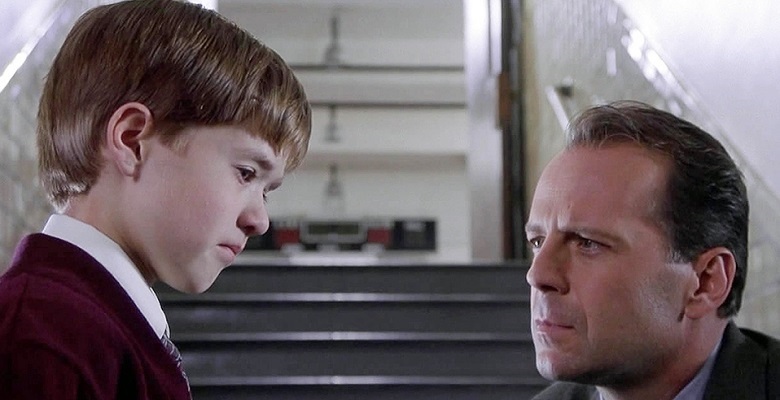
Locate an element on the screen. This screenshot has width=780, height=400. arm rail is located at coordinates (555, 104).